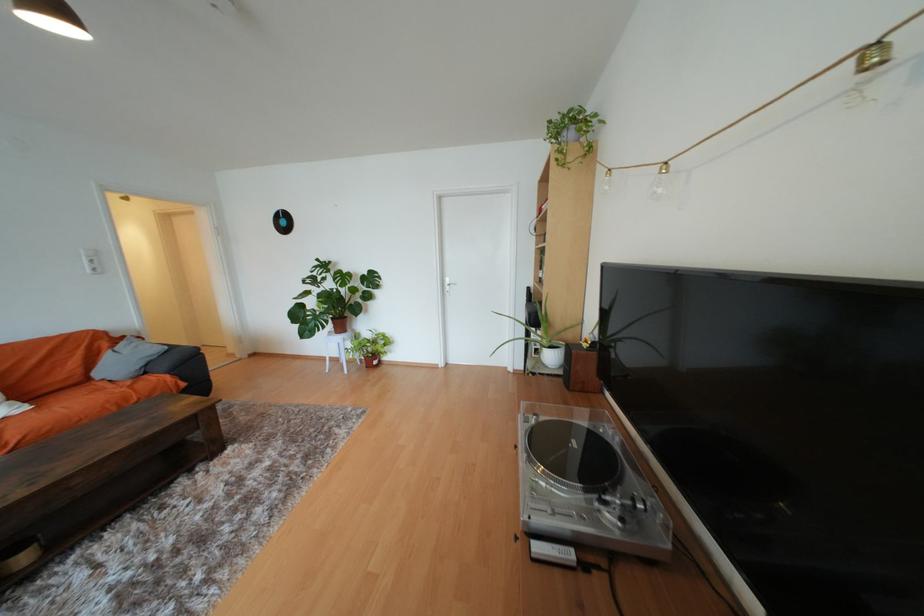
This screenshot has height=616, width=924. What do you see at coordinates (552, 553) in the screenshot? I see `the turntable start button` at bounding box center [552, 553].